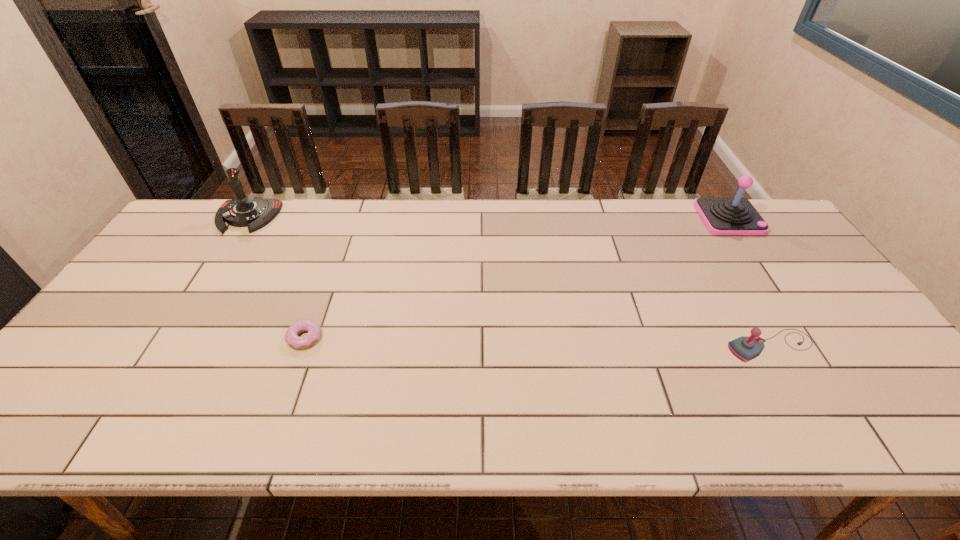
Where is `the leftmost object`? This screenshot has height=540, width=960. the leftmost object is located at coordinates (244, 210).

You are a GUI agent. You are given a task and a screenshot of the screen. Output one action in this format:
    pyautogui.click(x=<x>, y=<y>)
    Task: Click on the third tallest object
    Image resolution: width=960 pixels, height=540 pixels.
    Given the screenshot: What is the action you would take?
    pyautogui.click(x=745, y=348)

This screenshot has height=540, width=960. I want to click on the nearest joystick, so click(x=745, y=348).

In order to click on the shortest object in this screenshot , I will do `click(292, 339)`.

Where is `the third object from right to left`? The width and height of the screenshot is (960, 540). the third object from right to left is located at coordinates (292, 339).

The width and height of the screenshot is (960, 540). I want to click on free space located 0.310m on the handle side of the leftmost joystick, so click(x=190, y=306).

The width and height of the screenshot is (960, 540). Identify the location of vacant space located 0.320m on the left of the nearest joystick. (596, 346).

The image size is (960, 540). What are the coordinates of `vacant space located on the left of the shortest object` in the screenshot? It's located at (252, 338).

You are a GUI agent. You are given a task and a screenshot of the screen. Output one action in this format:
    pyautogui.click(x=<x>, y=<y>)
    Task: Click on the object at the left edge
    The image size is (960, 540).
    Given the screenshot: What is the action you would take?
    coord(244,210)

Identify the location of object at the far left corner. The width and height of the screenshot is (960, 540). (244, 210).